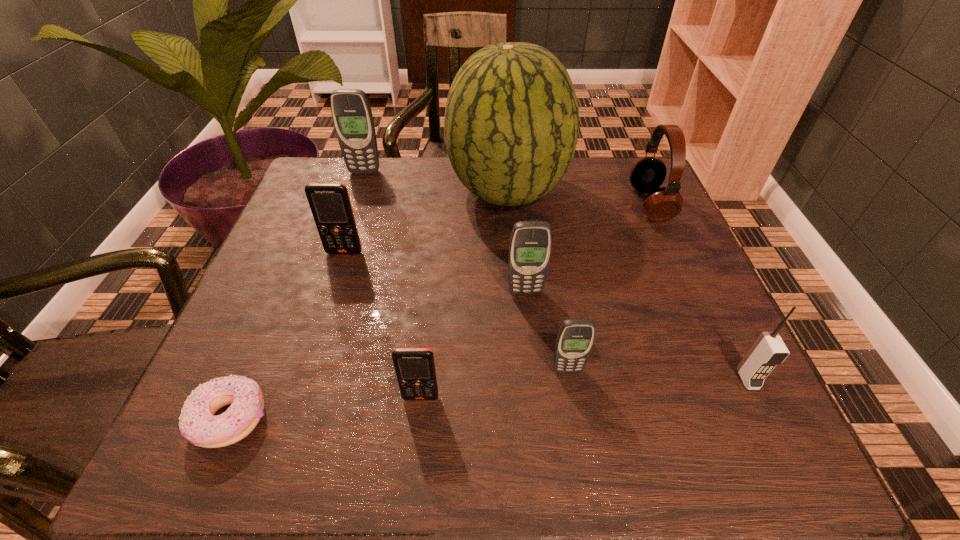
Find the location of a particular element. This screenshot has height=540, width=960. the tallest object is located at coordinates pyautogui.click(x=511, y=124).

Locate an element on the screen. The image size is (960, 540). green watermelon is located at coordinates (511, 124).

What are the coordinates of `the biggest gray cellular telephone` in the screenshot? It's located at (351, 112).

Locate an element on the screen. This screenshot has width=960, height=540. the farthest gray cellular telephone is located at coordinates (351, 112).

Where is `black headset`? The image size is (960, 540). black headset is located at coordinates (647, 174).

Locate an element on the screen. This screenshot has height=540, width=960. the fifth farthest object is located at coordinates click(530, 246).

The image size is (960, 540). I want to click on the second nearest gray cellular telephone, so click(530, 246).

Locate an element on the screen. The height and width of the screenshot is (540, 960). the fourth farthest object is located at coordinates (330, 204).

Where is `the second farthest cellular telephone`? This screenshot has width=960, height=540. the second farthest cellular telephone is located at coordinates (330, 204).

In order to click on the rightmost cellular telephone in this screenshot , I will do `click(769, 350)`.